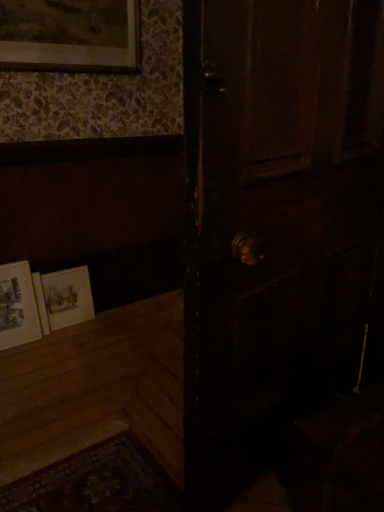
Question: Should I look upward or downward to see matte white picture frame at lower left, the second picture frame in the bottom-to-top sequence?

Choices:
 (A) down
 (B) up

Answer: (A)

Question: Is matte paper picture frame at lower left, the 1th picture frame in the bottom-to-top sequence, placed right next to dark wood door at center?

Choices:
 (A) yes
 (B) no

Answer: (B)

Question: Does matte paper picture frame at lower left, which is the third picture frame from top to bottom, have a lesser width compared to dark wood door at center?

Choices:
 (A) yes
 (B) no

Answer: (A)

Question: From the image's perspective, is matte paper picture frame at lower left, the 1th picture frame in the bottom-to-top sequence, under dark wood door at center?

Choices:
 (A) no
 (B) yes

Answer: (B)

Question: Does matte paper picture frame at lower left, the 1th picture frame in the bottom-to-top sequence, have a lesser height compared to dark wood door at center?

Choices:
 (A) yes
 (B) no

Answer: (A)

Question: Is matte paper picture frame at lower left, which is the third picture frame from top to bottom, outside dark wood door at center?

Choices:
 (A) yes
 (B) no

Answer: (A)

Question: Does matte paper picture frame at lower left, which is the third picture frame from top to bottom, have a larger size compared to dark wood door at center?

Choices:
 (A) yes
 (B) no

Answer: (B)

Question: Does matte paper picture frame at lower left, the 1th picture frame in the bottom-to-top sequence, appear on the right side of matte gold picture frame at upper left, which is the 1th picture frame from top to bottom?

Choices:
 (A) no
 (B) yes

Answer: (A)

Question: Is matte paper picture frame at lower left, the 1th picture frame in the bottom-to-top sequence, far from matte gold picture frame at upper left, which is the 1th picture frame from top to bottom?

Choices:
 (A) no
 (B) yes

Answer: (B)

Question: Is matte gold picture frame at upper left, the 3th picture frame from the bottom, at the back of matte paper picture frame at lower left, which is the third picture frame from top to bottom?

Choices:
 (A) no
 (B) yes

Answer: (A)

Question: Is matte paper picture frame at lower left, which is the third picture frame from top to bottom, bigger than matte gold picture frame at upper left, the 3th picture frame from the bottom?

Choices:
 (A) yes
 (B) no

Answer: (B)

Question: From a real-world perspective, is matte paper picture frame at lower left, the 1th picture frame in the bottom-to-top sequence, physically below matte gold picture frame at upper left, which is the 1th picture frame from top to bottom?

Choices:
 (A) yes
 (B) no

Answer: (A)

Question: Can you confirm if matte paper picture frame at lower left, the 1th picture frame in the bottom-to-top sequence, is thinner than matte gold picture frame at upper left, the 3th picture frame from the bottom?

Choices:
 (A) yes
 (B) no

Answer: (B)

Question: From a real-world perspective, is matte gold picture frame at upper left, which is the 1th picture frame from top to bottom, under matte paper picture frame at lower left, which is the third picture frame from top to bottom?

Choices:
 (A) no
 (B) yes

Answer: (A)